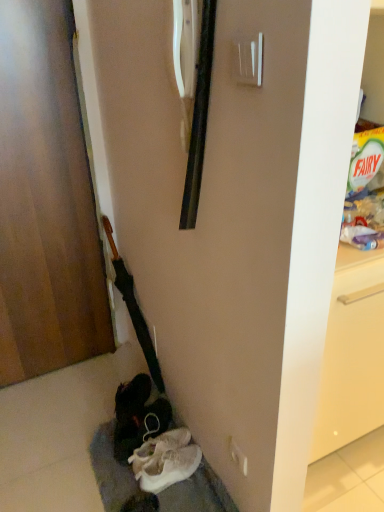
Where is `white plastic door handle at upper center`? This screenshot has width=384, height=512. white plastic door handle at upper center is located at coordinates (248, 60).

In order to face white fabric shoe at lower center, which is counted as the second footwear, starting from the front, should I rotate leftwards or rightwards?

Rotate left and turn 6.951 degrees.

How much space does white fabric shoe at lower center, which is counted as the second footwear, starting from the front, occupy vertically?

white fabric shoe at lower center, which is counted as the second footwear, starting from the front, is 6.31 inches in height.

Find the location of a particular element. white suede sneakers at lower center, which is counted as the second footwear, starting from the back is located at coordinates (165, 460).

Locate an element on the screen. wooden door at left is located at coordinates (45, 201).

Between white fabric shoe at lower center, which is counted as the second footwear, starting from the front, and white suede sneakers at lower center, the first footwear when ordered from front to back, which one is positioned in front?

Positioned in front is white suede sneakers at lower center, the first footwear when ordered from front to back.

Which is nearer, (x=141, y=408) or (x=165, y=462)?

Point (x=141, y=408) appears to be farther away from the viewer than point (x=165, y=462).

From the image's perspective, which is below, white fabric shoe at lower center, which is counted as the second footwear, starting from the front, or white suede sneakers at lower center, the first footwear when ordered from front to back?

white suede sneakers at lower center, the first footwear when ordered from front to back, appears lower in the image.

Is white fabric shoe at lower center, which is counted as the second footwear, starting from the front, turned away from white suede sneakers at lower center, which is counted as the second footwear, starting from the back?

white fabric shoe at lower center, which is counted as the second footwear, starting from the front, is not turned away from white suede sneakers at lower center, which is counted as the second footwear, starting from the back.

From the image's perspective, is white suede sneakers at lower center, the first footwear when ordered from front to back, on top of wooden door at left?

No, from the image's perspective, white suede sneakers at lower center, the first footwear when ordered from front to back, is not over wooden door at left.

Locate an element on the screen. This screenshot has width=384, height=512. door that appears above the white suede sneakers at lower center, which is counted as the second footwear, starting from the back (from the image's perspective) is located at coordinates (45, 201).

Is the depth of white suede sneakers at lower center, the first footwear when ordered from front to back, less than that of wooden door at left?

No, it is behind wooden door at left.

Which of these two, white suede sneakers at lower center, the first footwear when ordered from front to back, or wooden door at left, stands taller?

With more height is wooden door at left.

Considering the positions of point (257, 67) and point (80, 335), is point (257, 67) closer or farther from the camera than point (80, 335)?

Point (257, 67).

You are a GUI agent. You are given a task and a screenshot of the screen. Output one action in this format:
    pyautogui.click(x=<x>, y=<y>)
    Task: Click on the door below the white plastic door handle at upper center (from the image's perspective)
    This screenshot has width=384, height=512.
    Given the screenshot: What is the action you would take?
    pyautogui.click(x=45, y=201)

Considering the relative positions of white plastic door handle at upper center and wooden door at left in the image provided, is white plastic door handle at upper center to the right of wooden door at left from the viewer's perspective?

Correct, you'll find white plastic door handle at upper center to the right of wooden door at left.

Can you confirm if white plastic door handle at upper center is wider than wooden door at left?

Incorrect, the width of white plastic door handle at upper center does not surpass that of wooden door at left.

Is wooden door at left outside of white fabric shoe at lower center, positioned as the first footwear in back-to-front order?

Yes, wooden door at left is not within white fabric shoe at lower center, positioned as the first footwear in back-to-front order.

Consider the image. From the image's perspective, is wooden door at left located beneath white fabric shoe at lower center, which is counted as the second footwear, starting from the front?

No, from the image's perspective, wooden door at left is not below white fabric shoe at lower center, which is counted as the second footwear, starting from the front.

Which object is further away from the camera, wooden door at left or white fabric shoe at lower center, positioned as the first footwear in back-to-front order?

white fabric shoe at lower center, positioned as the first footwear in back-to-front order, is further away from the camera.

In terms of width, does wooden door at left look wider or thinner when compared to white fabric shoe at lower center, which is counted as the second footwear, starting from the front?

Considering their sizes, wooden door at left looks slimmer than white fabric shoe at lower center, which is counted as the second footwear, starting from the front.

Is white fabric shoe at lower center, positioned as the first footwear in back-to-front order, in contact with wooden door at left?

No, white fabric shoe at lower center, positioned as the first footwear in back-to-front order, is not in contact with wooden door at left.

Is white fabric shoe at lower center, positioned as the first footwear in back-to-front order, smaller than wooden door at left?

Yes, white fabric shoe at lower center, positioned as the first footwear in back-to-front order, is smaller than wooden door at left.

Is white fabric shoe at lower center, which is counted as the second footwear, starting from the front, at the right side of wooden door at left?

Yes, white fabric shoe at lower center, which is counted as the second footwear, starting from the front, is to the right of wooden door at left.

Is white fabric shoe at lower center, positioned as the first footwear in back-to-front order, not within wooden door at left?

That's correct, white fabric shoe at lower center, positioned as the first footwear in back-to-front order, is outside of wooden door at left.

Which point is more forward, (151, 461) or (167, 409)?

The point (151, 461) is more forward.

Can you confirm if white suede sneakers at lower center, which is counted as the second footwear, starting from the back, is taller than white fabric shoe at lower center, which is counted as the second footwear, starting from the front?

In fact, white suede sneakers at lower center, which is counted as the second footwear, starting from the back, may be shorter than white fabric shoe at lower center, which is counted as the second footwear, starting from the front.

From the image's perspective, relative to white fabric shoe at lower center, positioned as the first footwear in back-to-front order, is white suede sneakers at lower center, the first footwear when ordered from front to back, above or below?

white suede sneakers at lower center, the first footwear when ordered from front to back, is below white fabric shoe at lower center, positioned as the first footwear in back-to-front order.

Is wooden door at left completely or partially outside of white suede sneakers at lower center, the first footwear when ordered from front to back?

Absolutely, wooden door at left is external to white suede sneakers at lower center, the first footwear when ordered from front to back.

Is wooden door at left in front of or behind white suede sneakers at lower center, which is counted as the second footwear, starting from the back, in the image?

Clearly, wooden door at left is in front of white suede sneakers at lower center, which is counted as the second footwear, starting from the back.

Is wooden door at left positioned far away from white suede sneakers at lower center, which is counted as the second footwear, starting from the back?

No.

I want to click on footwear on the left side of white suede sneakers at lower center, which is counted as the second footwear, starting from the back, so click(x=138, y=416).

From the wooden door at left, count 1st footwears backward and point to it. Please provide its 2D coordinates.

[(165, 460)]

Based on their spatial positions, is wooden door at left or white suede sneakers at lower center, which is counted as the second footwear, starting from the back, further from white plastic door handle at upper center?

white suede sneakers at lower center, which is counted as the second footwear, starting from the back, is positioned further to the anchor white plastic door handle at upper center.

Which object lies nearer to the anchor point wooden door at left, white suede sneakers at lower center, the first footwear when ordered from front to back, or white plastic door handle at upper center?

Among the two, white suede sneakers at lower center, the first footwear when ordered from front to back, is located nearer to wooden door at left.

Looking at the image, which one is located closer to white suede sneakers at lower center, the first footwear when ordered from front to back, white plastic door handle at upper center or white fabric shoe at lower center, which is counted as the second footwear, starting from the front?

Among the two, white fabric shoe at lower center, which is counted as the second footwear, starting from the front, is located nearer to white suede sneakers at lower center, the first footwear when ordered from front to back.

Estimate the real-world distances between objects in this image. Which object is further from white plastic door handle at upper center, wooden door at left or white fabric shoe at lower center, which is counted as the second footwear, starting from the front?

The object further to white plastic door handle at upper center is white fabric shoe at lower center, which is counted as the second footwear, starting from the front.

Consider the image. From the image, which object appears to be farther from wooden door at left, white suede sneakers at lower center, which is counted as the second footwear, starting from the back, or white fabric shoe at lower center, which is counted as the second footwear, starting from the front?

Based on the image, white suede sneakers at lower center, which is counted as the second footwear, starting from the back, appears to be further to wooden door at left.

Considering their positions, is wooden door at left positioned further to white suede sneakers at lower center, which is counted as the second footwear, starting from the back, than white fabric shoe at lower center, positioned as the first footwear in back-to-front order?

wooden door at left is further to white suede sneakers at lower center, which is counted as the second footwear, starting from the back.

Based on their spatial positions, is white suede sneakers at lower center, which is counted as the second footwear, starting from the back, or white plastic door handle at upper center closer to white fabric shoe at lower center, which is counted as the second footwear, starting from the front?

white suede sneakers at lower center, which is counted as the second footwear, starting from the back.

When comparing their distances from white plastic door handle at upper center, does white fabric shoe at lower center, positioned as the first footwear in back-to-front order, or white suede sneakers at lower center, which is counted as the second footwear, starting from the back, seem closer?

The object closer to white plastic door handle at upper center is white suede sneakers at lower center, which is counted as the second footwear, starting from the back.

Where is `door between white plastic door handle at upper center and white fabric shoe at lower center, positioned as the first footwear in back-to-front order, in the vertical direction`? The height and width of the screenshot is (512, 384). door between white plastic door handle at upper center and white fabric shoe at lower center, positioned as the first footwear in back-to-front order, in the vertical direction is located at coordinates (45, 201).

The width and height of the screenshot is (384, 512). I want to click on door between white plastic door handle at upper center and white suede sneakers at lower center, which is counted as the second footwear, starting from the back, in the vertical direction, so click(45, 201).

Find the location of `footwear between white plastic door handle at upper center and white suede sneakers at lower center, which is counted as the second footwear, starting from the back, in the vertical direction`. footwear between white plastic door handle at upper center and white suede sneakers at lower center, which is counted as the second footwear, starting from the back, in the vertical direction is located at coordinates (138, 416).

The height and width of the screenshot is (512, 384). What are the coordinates of `footwear between wooden door at left and white suede sneakers at lower center, the first footwear when ordered from front to back, in the vertical direction` in the screenshot? It's located at (138, 416).